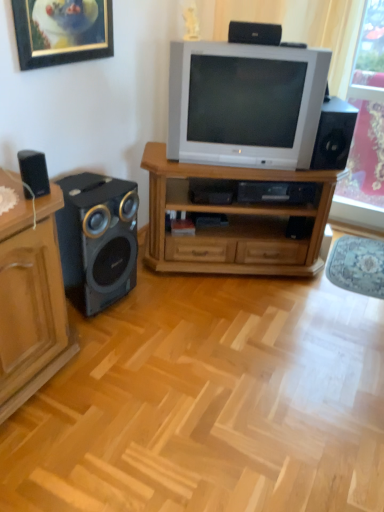
Image resolution: width=384 pixels, height=512 pixels. Describe the element at coordinates (30, 297) in the screenshot. I see `matte wood cabinet at left` at that location.

Image resolution: width=384 pixels, height=512 pixels. Describe the element at coordinates (98, 239) in the screenshot. I see `metallic black speaker at left, which is the first loudspeaker in bottom-to-top order` at that location.

Find the location of a particular element. gold-framed picture at upper left is located at coordinates (62, 31).

This screenshot has height=512, width=384. In order to click on black plastic speaker at upper center, placed as the third loudspeaker when sorted from left to right in this screenshot , I will do `click(254, 33)`.

Which of these two, black plastic speaker at upper center, arranged as the first loudspeaker when viewed from the top, or metallic black speaker at left, the third loudspeaker viewed from the right, stands taller?

metallic black speaker at left, the third loudspeaker viewed from the right.

From the image's perspective, who appears lower, black plastic speaker at upper center, positioned as the second loudspeaker in right-to-left order, or metallic black speaker at left, the third loudspeaker viewed from the right?

metallic black speaker at left, the third loudspeaker viewed from the right.

Can you confirm if black plastic speaker at upper center, the 4th loudspeaker ordered from the bottom, is wider than metallic black speaker at left, placed as the second loudspeaker when sorted from left to right?

Incorrect, the width of black plastic speaker at upper center, the 4th loudspeaker ordered from the bottom, does not surpass that of metallic black speaker at left, placed as the second loudspeaker when sorted from left to right.

Is black matte speaker at left, the 1th loudspeaker viewed from the left, surrounding metallic black speaker at left, placed as the second loudspeaker when sorted from left to right?

No, metallic black speaker at left, placed as the second loudspeaker when sorted from left to right, is not a part of black matte speaker at left, the 1th loudspeaker viewed from the left.

Is black matte speaker at left, the 1th loudspeaker viewed from the left, turned away from metallic black speaker at left, which is the first loudspeaker in bottom-to-top order?

No, black matte speaker at left, the 1th loudspeaker viewed from the left, is not facing the opposite direction of metallic black speaker at left, which is the first loudspeaker in bottom-to-top order.

Considering the relative sizes of black matte speaker at left, the 3th loudspeaker when ordered from top to bottom, and metallic black speaker at left, the third loudspeaker viewed from the right, in the image provided, is black matte speaker at left, the 3th loudspeaker when ordered from top to bottom, taller than metallic black speaker at left, the third loudspeaker viewed from the right,?

No, black matte speaker at left, the 3th loudspeaker when ordered from top to bottom, is not taller than metallic black speaker at left, the third loudspeaker viewed from the right.

From the picture: Does black matte speaker at left, the second loudspeaker positioned from the bottom, come in front of metallic black speaker at left, which is the 4th loudspeaker from top to bottom?

Yes, black matte speaker at left, the second loudspeaker positioned from the bottom, is closer to the viewer.

In terms of size, does black plastic speaker at upper center, placed as the third loudspeaker when sorted from left to right, appear bigger or smaller than white plastic television at center?

Considering their sizes, black plastic speaker at upper center, placed as the third loudspeaker when sorted from left to right, takes up less space than white plastic television at center.

The image size is (384, 512). I want to click on television on the left of the black plastic speaker at upper center, positioned as the second loudspeaker in right-to-left order, so click(x=245, y=104).

Is black plastic speaker at upper center, positioned as the second loudspeaker in right-to-left order, outside of white plastic television at center?

Indeed, black plastic speaker at upper center, positioned as the second loudspeaker in right-to-left order, is completely outside white plastic television at center.

Can you confirm if black plastic speaker at upper center, positioned as the second loudspeaker in right-to-left order, is wider than white plastic television at center?

No, black plastic speaker at upper center, positioned as the second loudspeaker in right-to-left order, is not wider than white plastic television at center.

Could you tell me if matte wood cabinet at left is turned towards wooden tv stand at center?

No.

Is matte wood cabinet at left next to wooden tv stand at center?

No, matte wood cabinet at left is not beside wooden tv stand at center.

Between matte wood cabinet at left and wooden tv stand at center, which one appears on the left side from the viewer's perspective?

Positioned to the left is matte wood cabinet at left.

Is white plastic television at center inside the boundaries of black plastic speaker at upper center, arranged as the first loudspeaker when viewed from the top, or outside?

white plastic television at center is spatially situated outside black plastic speaker at upper center, arranged as the first loudspeaker when viewed from the top.

Is white plastic television at center with black plastic speaker at upper center, positioned as the second loudspeaker in right-to-left order?

No, white plastic television at center is not in contact with black plastic speaker at upper center, positioned as the second loudspeaker in right-to-left order.

Can you confirm if white plastic television at center is smaller than black plastic speaker at upper center, placed as the third loudspeaker when sorted from left to right?

No.

Where is `the 2nd loudspeaker counting from the right side of the black matte speaker at left, the 1th loudspeaker viewed from the left`? The height and width of the screenshot is (512, 384). the 2nd loudspeaker counting from the right side of the black matte speaker at left, the 1th loudspeaker viewed from the left is located at coordinates (254, 33).

From a real-world perspective, is black matte speaker at left, placed as the 4th loudspeaker when sorted from right to left, physically below black plastic speaker at upper center, placed as the third loudspeaker when sorted from left to right?

Correct, in the physical world, black matte speaker at left, placed as the 4th loudspeaker when sorted from right to left, is lower than black plastic speaker at upper center, placed as the third loudspeaker when sorted from left to right.

Is black matte speaker at left, the 1th loudspeaker viewed from the left, taller or shorter than black plastic speaker at upper center, arranged as the first loudspeaker when viewed from the top?

In the image, black matte speaker at left, the 1th loudspeaker viewed from the left, appears to be taller than black plastic speaker at upper center, arranged as the first loudspeaker when viewed from the top.

Choose the correct answer: Is black matte speaker at left, the 1th loudspeaker viewed from the left, inside black plastic speaker at upper center, the 4th loudspeaker ordered from the bottom, or outside it?

black matte speaker at left, the 1th loudspeaker viewed from the left, is located beyond the bounds of black plastic speaker at upper center, the 4th loudspeaker ordered from the bottom.

Is black plastic speaker at upper center, arranged as the first loudspeaker when viewed from the top, far away from wooden tv stand at center?

black plastic speaker at upper center, arranged as the first loudspeaker when viewed from the top, is actually quite close to wooden tv stand at center.

Does black plastic speaker at upper center, positioned as the second loudspeaker in right-to-left order, have a lesser height compared to wooden tv stand at center?

Correct, black plastic speaker at upper center, positioned as the second loudspeaker in right-to-left order, is not as tall as wooden tv stand at center.

Is black plastic speaker at upper center, the 4th loudspeaker ordered from the bottom, further to the viewer compared to wooden tv stand at center?

No, it is in front of wooden tv stand at center.

Does black plastic speaker at upper center, placed as the third loudspeaker when sorted from left to right, have a greater width compared to wooden tv stand at center?

No.

From the image's perspective, count 3rd loudspeakers upward from the metallic black speaker at left, which is the 4th loudspeaker from top to bottom, and point to it. Please provide its 2D coordinates.

[(254, 33)]

Locate an element on the screen. This screenshot has height=512, width=384. loudspeaker that is the 1st one when counting backward from the black matte speaker at left, the second loudspeaker positioned from the bottom is located at coordinates (98, 239).

Which object lies further to the anchor point wooden tv stand at center, black plastic speaker at right, acting as the 1th loudspeaker starting from the right, or black matte speaker at left, placed as the 4th loudspeaker when sorted from right to left?

black matte speaker at left, placed as the 4th loudspeaker when sorted from right to left, lies further to wooden tv stand at center than the other object.

From the image, which object appears to be nearer to pink floral curtain at right, black matte speaker at left, the 3th loudspeaker when ordered from top to bottom, or white plastic television at center?

white plastic television at center is positioned closer to the anchor pink floral curtain at right.

Considering their positions, is white plastic television at center positioned closer to gold-framed picture at upper left than pink floral curtain at right?

The object closer to gold-framed picture at upper left is white plastic television at center.

Estimate the real-world distances between objects in this image. Which object is further from black plastic speaker at right, acting as the 1th loudspeaker starting from the right, pink floral curtain at right or black matte speaker at left, the 3th loudspeaker when ordered from top to bottom?

The object further to black plastic speaker at right, acting as the 1th loudspeaker starting from the right, is black matte speaker at left, the 3th loudspeaker when ordered from top to bottom.

Based on their spatial positions, is white plastic television at center or pink floral curtain at right further from black matte speaker at left, placed as the 4th loudspeaker when sorted from right to left?

pink floral curtain at right is positioned further to the anchor black matte speaker at left, placed as the 4th loudspeaker when sorted from right to left.

Based on their spatial positions, is gold-framed picture at upper left or pink floral curtain at right further from black plastic speaker at right, the fourth loudspeaker positioned from the left?

gold-framed picture at upper left is positioned further to the anchor black plastic speaker at right, the fourth loudspeaker positioned from the left.

Which object lies nearer to the anchor point black matte speaker at left, the 3th loudspeaker when ordered from top to bottom, metallic black speaker at left, the third loudspeaker viewed from the right, or black plastic speaker at upper center, positioned as the second loudspeaker in right-to-left order?

metallic black speaker at left, the third loudspeaker viewed from the right, is positioned closer to the anchor black matte speaker at left, the 3th loudspeaker when ordered from top to bottom.

Based on their spatial positions, is wooden tv stand at center or white plastic television at center further from metallic black speaker at left, which is the first loudspeaker in bottom-to-top order?

Based on the image, white plastic television at center appears to be further to metallic black speaker at left, which is the first loudspeaker in bottom-to-top order.

Find the location of a particular element. This screenshot has width=384, height=512. desk between gold-framed picture at upper left and black plastic speaker at upper center, placed as the third loudspeaker when sorted from left to right, in the horizontal direction is located at coordinates (233, 222).

Find the location of a particular element. The width and height of the screenshot is (384, 512). loudspeaker located between black plastic speaker at upper center, arranged as the first loudspeaker when viewed from the top, and pink floral curtain at right in the left-right direction is located at coordinates click(334, 134).

The image size is (384, 512). I want to click on loudspeaker between white plastic television at center and black plastic speaker at right, marked as the 3th loudspeaker in a bottom-to-top arrangement, in the horizontal direction, so click(254, 33).

You are a GUI agent. You are given a task and a screenshot of the screen. Output one action in this format:
    pyautogui.click(x=<x>, y=<y>)
    Task: Click on the television between matte wood cabinet at left and pink floral curtain at right
    Image resolution: width=384 pixels, height=512 pixels.
    Given the screenshot: What is the action you would take?
    pyautogui.click(x=245, y=104)